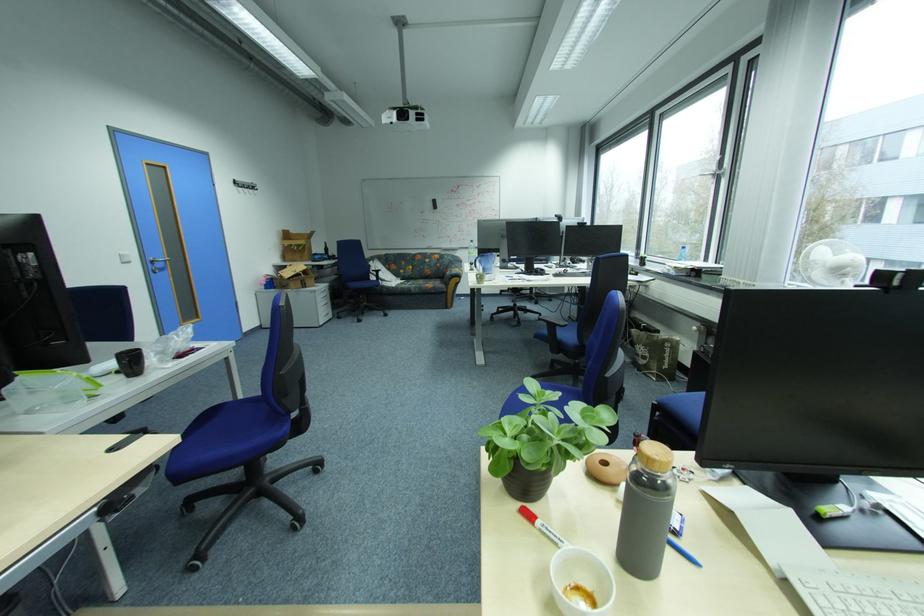
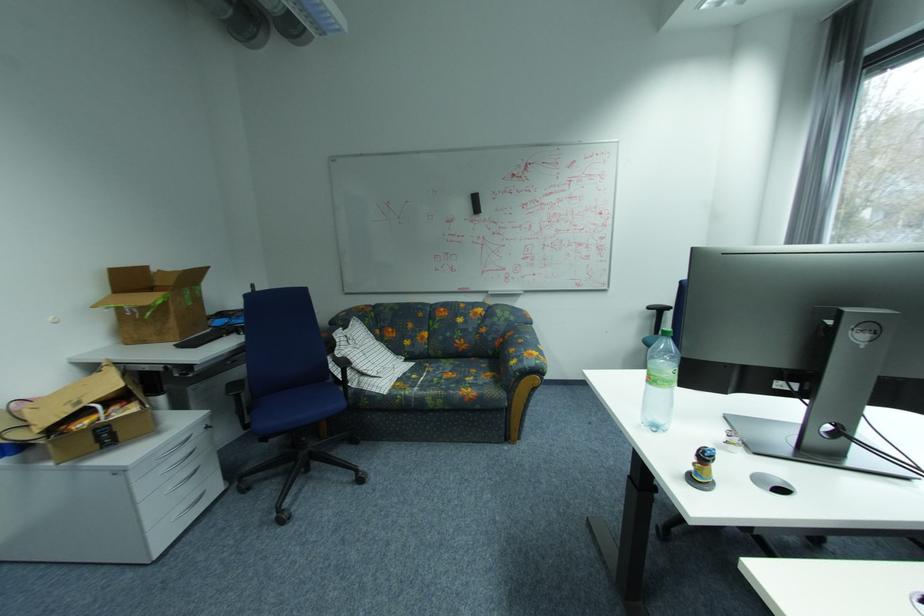
The point at [440,206] is marked in the first image. Where is the corresponding point in the second image?

(476, 206)